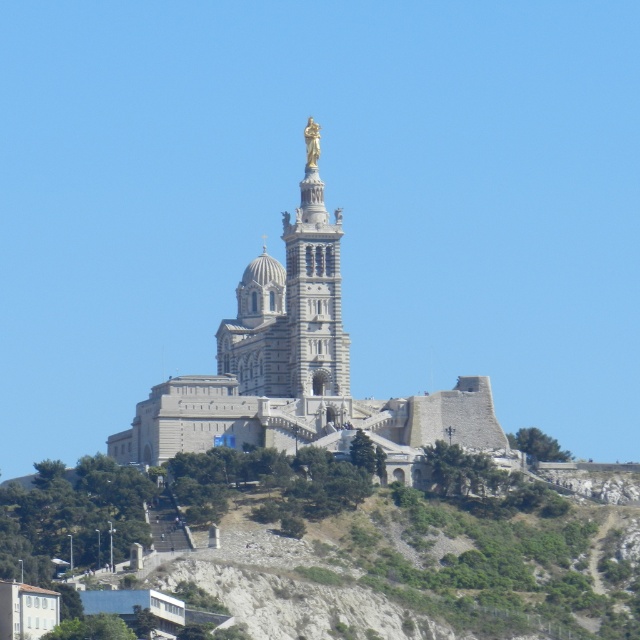
You are a tour guide explaining the religious structure to visitors. You want to mention the distance between the gold metallic statue at center and the gold polished statue at upper center. How far apart are they?

The gold metallic statue at center and the gold polished statue at upper center are 35.00 feet apart from each other.

You are a tourist standing at the base of the hill looking up at the beige stone church at center and the gold metallic statue at center. Which object is closer to you?

The beige stone church at center is closer to you because it is in front of the gold metallic statue at center.

You are a tourist visiting the religious site and want to take a photo of the beige stone church at center and the gold metallic statue at center. Which one should you focus on if you want to capture the tallest object in the scene?

The beige stone church at center is much taller than the gold metallic statue at center, so you should focus on the beige stone church at center to capture the tallest object in the scene.